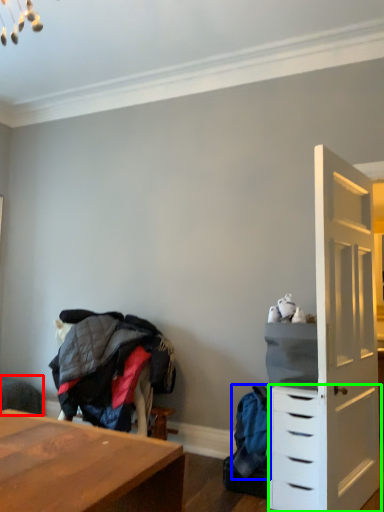
Question: Considering the real-world distances, which object is farthest from swivel chair (highlighted by a red box)? clothing (highlighted by a blue box) or chest of drawers (highlighted by a green box)?

Choices:
 (A) clothing
 (B) chest of drawers

Answer: (B)